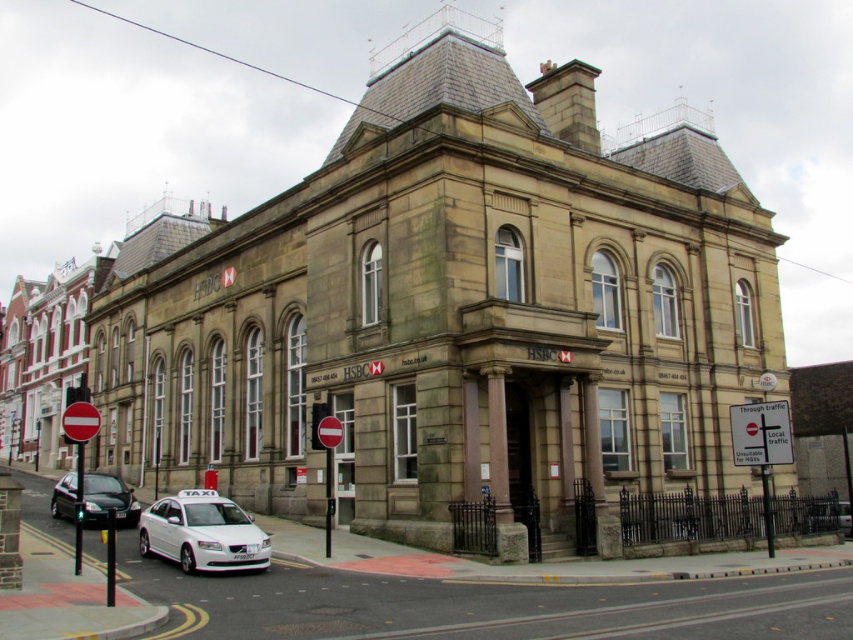
Is point (143, 547) positioned in front of point (782, 401)?

Yes, point (143, 547) is closer to viewer.

Is point (245, 538) in front of point (762, 465)?

That is True.

Locate an element on the screen. white glossy taxi at center is located at coordinates (202, 532).

Who is taller, white glossy taxi at center or shiny black sedan at lower left?

shiny black sedan at lower left is taller.

Looking at this image, does white glossy taxi at center have a larger size compared to shiny black sedan at lower left?

Incorrect, white glossy taxi at center is not larger than shiny black sedan at lower left.

The height and width of the screenshot is (640, 853). In order to click on white glossy taxi at center in this screenshot , I will do `click(202, 532)`.

Image resolution: width=853 pixels, height=640 pixels. I want to click on white glossy taxi at center, so click(x=202, y=532).

In the scene shown: Is white plastic sign at lower right to the right of shiny black sedan at lower left from the viewer's perspective?

Indeed, white plastic sign at lower right is positioned on the right side of shiny black sedan at lower left.

Does point (747, 412) lie behind point (91, 509)?

Yes, it is behind point (91, 509).

Does point (770, 442) lie behind point (73, 474)?

No, (770, 442) is in front of (73, 474).

The image size is (853, 640). In order to click on white plastic sign at lower right in this screenshot , I will do `click(759, 433)`.